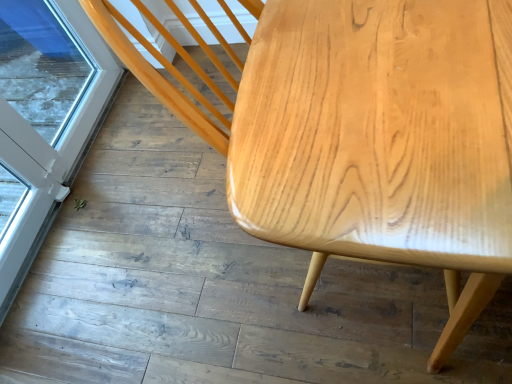
Question: Are light wood table at upper right and transparent glass screen door at lower left located far from each other?

Choices:
 (A) yes
 (B) no

Answer: (A)

Question: Can you confirm if light wood table at upper right is taller than transparent glass screen door at lower left?

Choices:
 (A) no
 (B) yes

Answer: (A)

Question: Is light wood table at upper right placed right next to transparent glass screen door at lower left?

Choices:
 (A) no
 (B) yes

Answer: (A)

Question: Is light wood table at upper right positioned with its back to transparent glass screen door at lower left?

Choices:
 (A) yes
 (B) no

Answer: (B)

Question: Is light wood table at upper right positioned in front of transparent glass screen door at lower left?

Choices:
 (A) no
 (B) yes

Answer: (B)

Question: Is light wood table at upper right thinner than transparent glass screen door at lower left?

Choices:
 (A) no
 (B) yes

Answer: (A)

Question: Can you confirm if transparent glass screen door at lower left is shorter than light wood table at upper right?

Choices:
 (A) yes
 (B) no

Answer: (B)

Question: Would you consider transparent glass screen door at lower left to be distant from light wood table at upper right?

Choices:
 (A) yes
 (B) no

Answer: (A)

Question: Is transparent glass screen door at lower left thinner than light wood table at upper right?

Choices:
 (A) no
 (B) yes

Answer: (B)

Question: Is transparent glass screen door at lower left positioned with its back to light wood table at upper right?

Choices:
 (A) yes
 (B) no

Answer: (B)

Question: From a real-world perspective, is transparent glass screen door at lower left under light wood table at upper right?

Choices:
 (A) yes
 (B) no

Answer: (B)

Question: From the image's perspective, is transparent glass screen door at lower left located beneath light wood table at upper right?

Choices:
 (A) no
 (B) yes

Answer: (A)

Question: Visually, is light wood table at upper right positioned to the left or to the right of transparent glass screen door at lower left?

Choices:
 (A) left
 (B) right

Answer: (B)